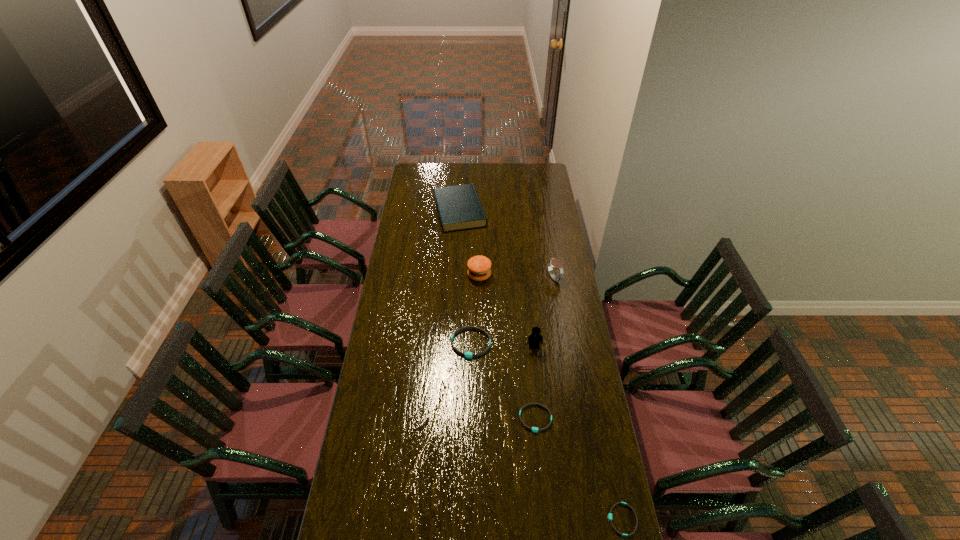
Choose which wristband is the nearest neighbor to the third shortest object. Please provide its 2D coordinates. Your answer should be formatted as a tuple, i.e. [(x, y)], where the tuple contains the x and y coordinates of a point satisfying the conditions above.

[(534, 429)]